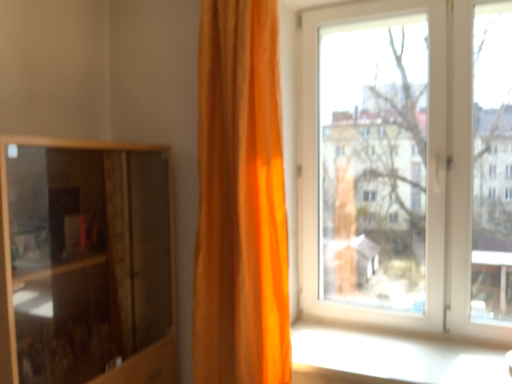
Question: Is white plastic window at upper right oriented towards orange fabric curtain at center?

Choices:
 (A) no
 (B) yes

Answer: (B)

Question: Is white plastic window at upper right oriented away from orange fabric curtain at center?

Choices:
 (A) no
 (B) yes

Answer: (A)

Question: Is white plastic window at upper right smaller than orange fabric curtain at center?

Choices:
 (A) no
 (B) yes

Answer: (A)

Question: Can you confirm if white plastic window at upper right is shorter than orange fabric curtain at center?

Choices:
 (A) no
 (B) yes

Answer: (B)

Question: Considering the relative sizes of white plastic window at upper right and orange fabric curtain at center in the image provided, is white plastic window at upper right bigger than orange fabric curtain at center?

Choices:
 (A) no
 (B) yes

Answer: (B)

Question: Is wooden cabinet at left inside the boundaries of white glossy window sill at lower right, or outside?

Choices:
 (A) outside
 (B) inside

Answer: (A)

Question: In terms of size, does wooden cabinet at left appear bigger or smaller than white glossy window sill at lower right?

Choices:
 (A) small
 (B) big

Answer: (B)

Question: In terms of height, does wooden cabinet at left look taller or shorter compared to white glossy window sill at lower right?

Choices:
 (A) tall
 (B) short

Answer: (A)

Question: Is point (141, 317) positioned closer to the camera than point (306, 334)?

Choices:
 (A) closer
 (B) farther

Answer: (B)

Question: From the image's perspective, is white glossy window sill at lower right positioned above or below orange fabric curtain at center?

Choices:
 (A) below
 (B) above

Answer: (A)

Question: Looking at their shapes, would you say white glossy window sill at lower right is wider or thinner than orange fabric curtain at center?

Choices:
 (A) wide
 (B) thin

Answer: (A)

Question: Is point (421, 357) closer or farther from the camera than point (273, 150)?

Choices:
 (A) closer
 (B) farther

Answer: (B)

Question: Is white glossy window sill at lower right spatially inside orange fabric curtain at center, or outside of it?

Choices:
 (A) outside
 (B) inside

Answer: (A)

Question: Would you say orange fabric curtain at center is inside or outside white plastic window at upper right?

Choices:
 (A) outside
 (B) inside

Answer: (A)

Question: Considering the positions of orange fabric curtain at center and white plastic window at upper right in the image, is orange fabric curtain at center taller or shorter than white plastic window at upper right?

Choices:
 (A) short
 (B) tall

Answer: (B)